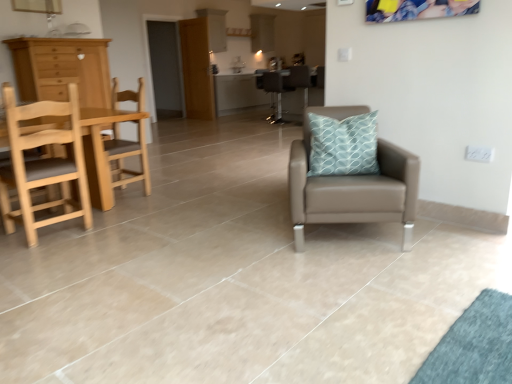
Question: Is leather armchair at center, which is the first chair in front-to-back order, shorter than metallic silver stool at center, which is the 5th chair in front-to-back order?

Choices:
 (A) yes
 (B) no

Answer: (A)

Question: Can you confirm if leather armchair at center, which is the first chair in front-to-back order, is bigger than metallic silver stool at center, the third chair from the right?

Choices:
 (A) yes
 (B) no

Answer: (A)

Question: From the image's perspective, is leather armchair at center, marked as the fifth chair in a back-to-front arrangement, on top of metallic silver stool at center, the third chair from the right?

Choices:
 (A) no
 (B) yes

Answer: (A)

Question: Can you confirm if leather armchair at center, marked as the fifth chair in a back-to-front arrangement, is smaller than metallic silver stool at center, which is the 5th chair in front-to-back order?

Choices:
 (A) yes
 (B) no

Answer: (B)

Question: Could you tell me if leather armchair at center, which is the first chair in front-to-back order, is facing metallic silver stool at center, the first chair in the back-to-front sequence?

Choices:
 (A) yes
 (B) no

Answer: (B)

Question: From the image's perspective, relative to brown leather armchair at center, is wooden table at left, the second table positioned from the top, above or below?

Choices:
 (A) below
 (B) above

Answer: (A)

Question: Based on their sizes in the image, would you say wooden table at left, the second table viewed from the back, is bigger or smaller than brown leather armchair at center?

Choices:
 (A) big
 (B) small

Answer: (A)

Question: Is wooden table at left, the second table positioned from the top, inside the boundaries of brown leather armchair at center, or outside?

Choices:
 (A) outside
 (B) inside

Answer: (A)

Question: From a real-world perspective, relative to brown leather armchair at center, is wooden table at left, marked as the 1th table in a bottom-to-top arrangement, vertically above or below?

Choices:
 (A) above
 (B) below

Answer: (B)

Question: Would you say light wood/woodenobject at left is to the left or to the right of metallic silver stool at center, which is the 5th chair in front-to-back order, in the picture?

Choices:
 (A) right
 (B) left

Answer: (B)

Question: Looking at the image, does light wood/woodenobject at left seem bigger or smaller compared to metallic silver stool at center, which is the third chair in left-to-right order?

Choices:
 (A) small
 (B) big

Answer: (B)

Question: From a real-world perspective, is light wood/woodenobject at left physically located above or below metallic silver stool at center, the third chair from the right?

Choices:
 (A) above
 (B) below

Answer: (A)

Question: From the image's perspective, relative to metallic silver stool at center, which is the 5th chair in front-to-back order, is light wood/woodenobject at left above or below?

Choices:
 (A) above
 (B) below

Answer: (B)

Question: Visually, is leather armchair at center, arranged as the first chair when viewed from the right, positioned to the left or to the right of metallic silver table at center, the 1th table positioned from the top?

Choices:
 (A) left
 (B) right

Answer: (B)

Question: Would you say leather armchair at center, the 5th chair positioned from the left, is inside or outside metallic silver table at center, acting as the 2th table starting from the front?

Choices:
 (A) inside
 (B) outside

Answer: (B)